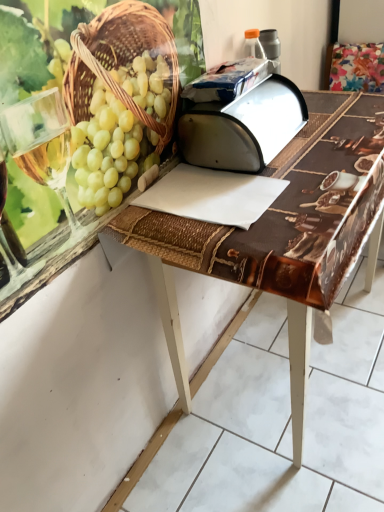
What is the approximate width of brown woven table at center?

It is 19.75 inches.

This screenshot has height=512, width=384. What do you see at coordinates (278, 233) in the screenshot?
I see `brown woven table at center` at bounding box center [278, 233].

Find the location of a particular element. The width and height of the screenshot is (384, 512). brown woven table at center is located at coordinates (278, 233).

This screenshot has height=512, width=384. What are the coordinates of `brown woven table at center` in the screenshot? It's located at (278, 233).